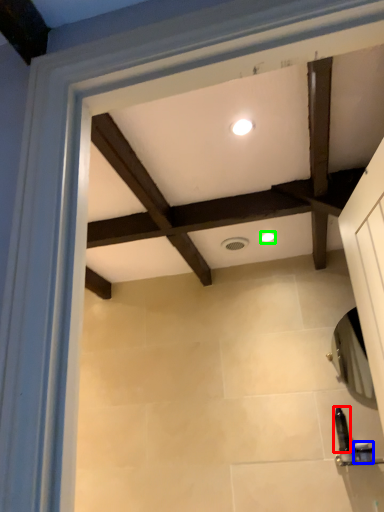
Question: Estimate the real-world distances between objects in this image. Which object is closer to toiletry (highlighted by a red box), toiletry (highlighted by a blue box) or lighting (highlighted by a green box)?

Choices:
 (A) toiletry
 (B) lighting

Answer: (A)